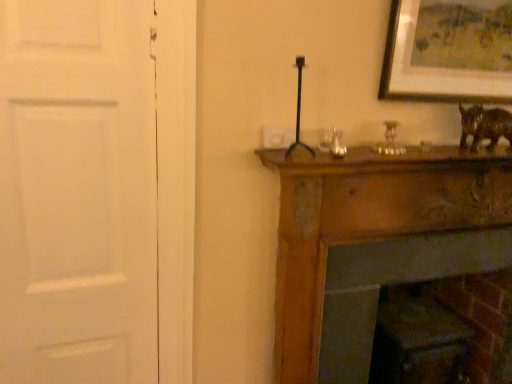
Question: Is metallic gold candle holder at upper center surrounding white matte door at left?

Choices:
 (A) yes
 (B) no

Answer: (B)

Question: Can you confirm if metallic gold candle holder at upper center is wider than white matte door at left?

Choices:
 (A) no
 (B) yes

Answer: (B)

Question: Is metallic gold candle holder at upper center positioned far away from white matte door at left?

Choices:
 (A) no
 (B) yes

Answer: (A)

Question: Is metallic gold candle holder at upper center oriented away from white matte door at left?

Choices:
 (A) yes
 (B) no

Answer: (B)

Question: Is metallic gold candle holder at upper center shorter than white matte door at left?

Choices:
 (A) no
 (B) yes

Answer: (B)

Question: Does metallic gold candle holder at upper center have a larger size compared to white matte door at left?

Choices:
 (A) yes
 (B) no

Answer: (B)

Question: Is white matte door at left oriented towards brown glossy statue at upper right?

Choices:
 (A) no
 (B) yes

Answer: (A)

Question: From a real-world perspective, is white matte door at left physically above brown glossy statue at upper right?

Choices:
 (A) no
 (B) yes

Answer: (A)

Question: Are white matte door at left and brown glossy statue at upper right located far from each other?

Choices:
 (A) yes
 (B) no

Answer: (A)

Question: From the image's perspective, is white matte door at left beneath brown glossy statue at upper right?

Choices:
 (A) no
 (B) yes

Answer: (B)

Question: Is white matte door at left wider than brown glossy statue at upper right?

Choices:
 (A) yes
 (B) no

Answer: (B)

Question: Would you say white matte door at left contains brown glossy statue at upper right?

Choices:
 (A) no
 (B) yes

Answer: (A)

Question: Can you confirm if brown glossy statue at upper right is wider than white matte door at left?

Choices:
 (A) no
 (B) yes

Answer: (B)